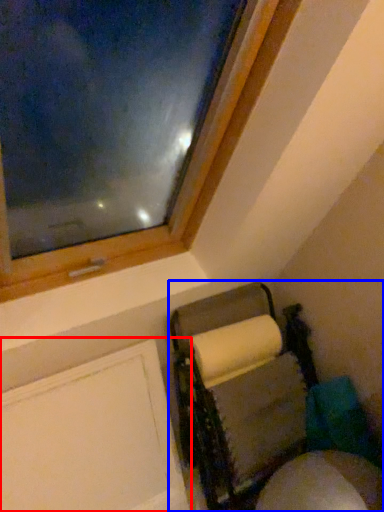
Question: Which of the following is the closest to the observer, screen door (highlighted by a red box) or furniture (highlighted by a blue box)?

Choices:
 (A) screen door
 (B) furniture

Answer: (A)